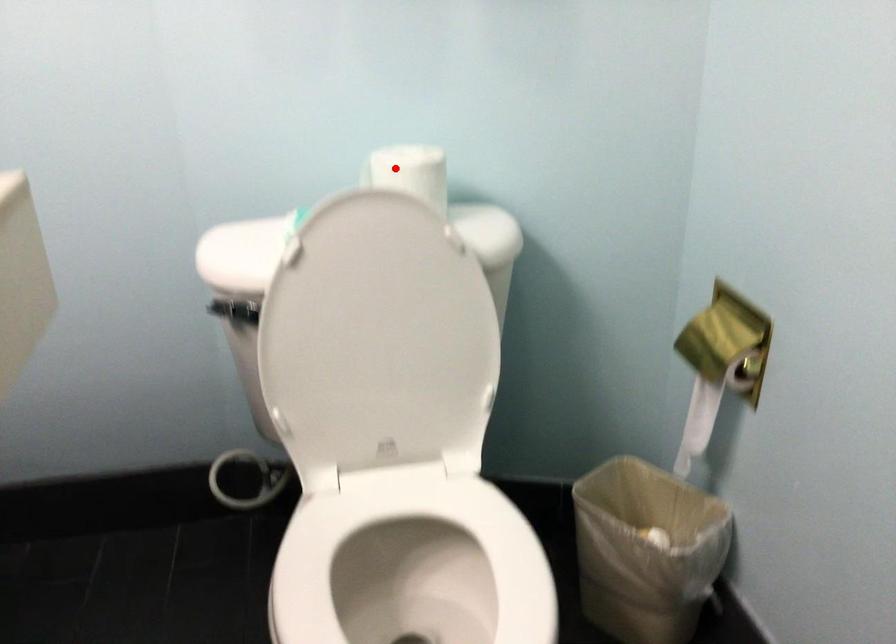
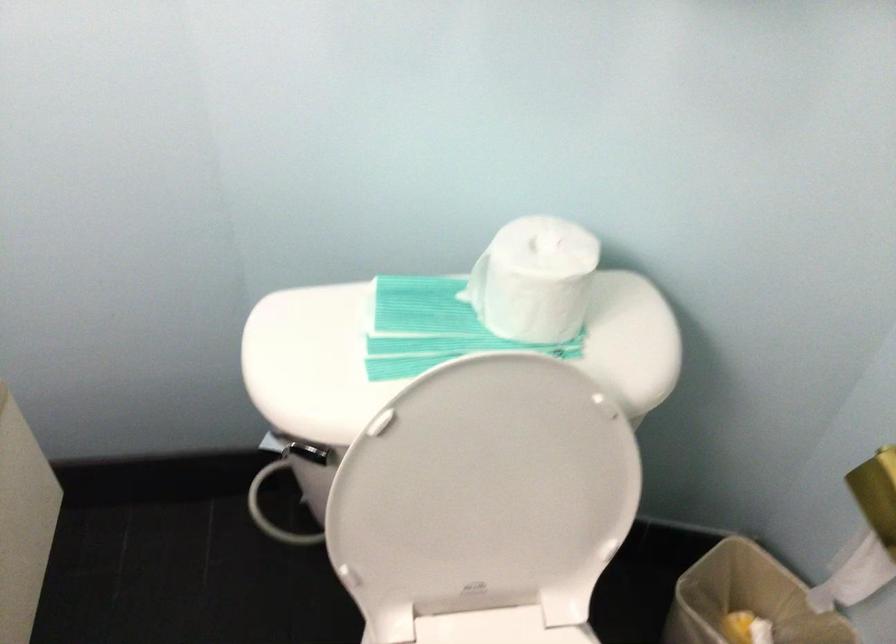
Locate, in the second image, the point that corresponds to the highlighted location in the first image.

(535, 279)